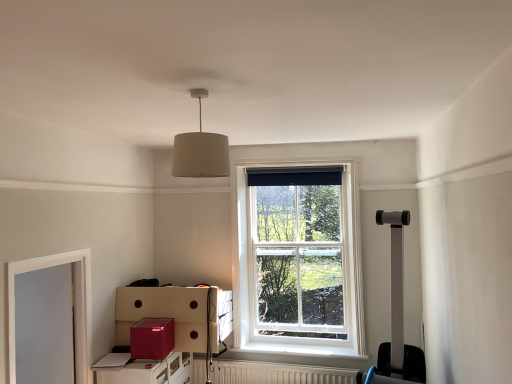
Question: Is white wooden window at center positioned behind metallic red file cabinet at lower left?

Choices:
 (A) yes
 (B) no

Answer: (A)

Question: From a real-world perspective, is white wooden window at center physically below metallic red file cabinet at lower left?

Choices:
 (A) no
 (B) yes

Answer: (A)

Question: From a real-world perspective, is white wooden window at center on top of metallic red file cabinet at lower left?

Choices:
 (A) yes
 (B) no

Answer: (A)

Question: Can you confirm if white wooden window at center is taller than metallic red file cabinet at lower left?

Choices:
 (A) no
 (B) yes

Answer: (B)

Question: Is white wooden window at center placed right next to metallic red file cabinet at lower left?

Choices:
 (A) no
 (B) yes

Answer: (A)

Question: Is point (187, 364) positioned closer to the camera than point (250, 266)?

Choices:
 (A) farther
 (B) closer

Answer: (B)

Question: Based on their sizes in the image, would you say metallic red file cabinet at lower left is bigger or smaller than white wooden window at center?

Choices:
 (A) small
 (B) big

Answer: (B)

Question: Visually, is metallic red file cabinet at lower left positioned to the left or to the right of white wooden window at center?

Choices:
 (A) left
 (B) right

Answer: (A)

Question: Looking at their shapes, would you say metallic red file cabinet at lower left is wider or thinner than white wooden window at center?

Choices:
 (A) thin
 (B) wide

Answer: (B)

Question: In terms of size, does white textured radiator at lower center appear bigger or smaller than white wooden window at center?

Choices:
 (A) big
 (B) small

Answer: (B)

Question: Looking at their shapes, would you say white textured radiator at lower center is wider or thinner than white wooden window at center?

Choices:
 (A) wide
 (B) thin

Answer: (A)

Question: Considering their positions, is white textured radiator at lower center located in front of or behind white wooden window at center?

Choices:
 (A) behind
 (B) front

Answer: (B)

Question: Based on their positions, is white textured radiator at lower center located to the left or right of white wooden window at center?

Choices:
 (A) right
 (B) left

Answer: (B)

Question: Do you think glossy cardboard box at lower left is within white wood frame at left, or outside of it?

Choices:
 (A) outside
 (B) inside

Answer: (A)

Question: Is glossy cardboard box at lower left taller or shorter than white wood frame at left?

Choices:
 (A) short
 (B) tall

Answer: (A)